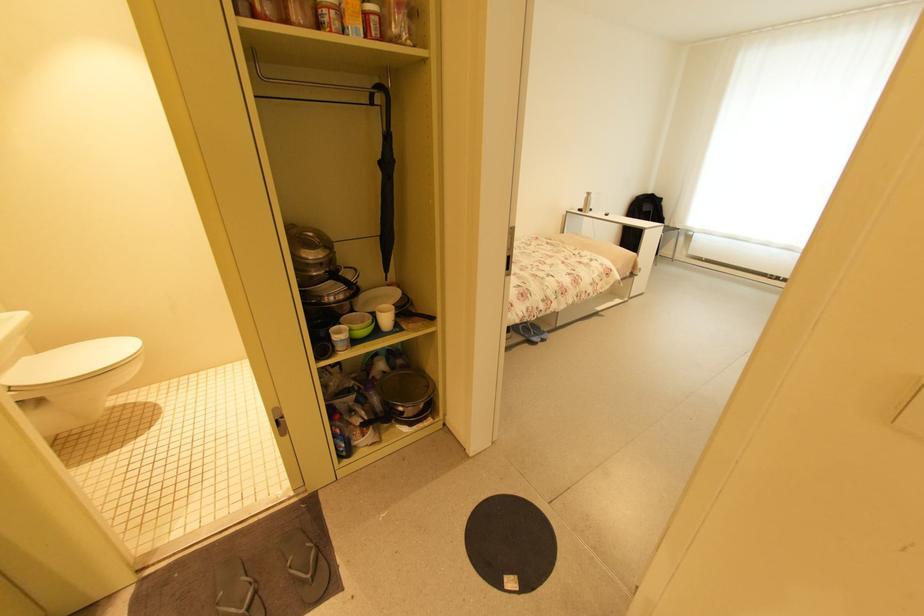
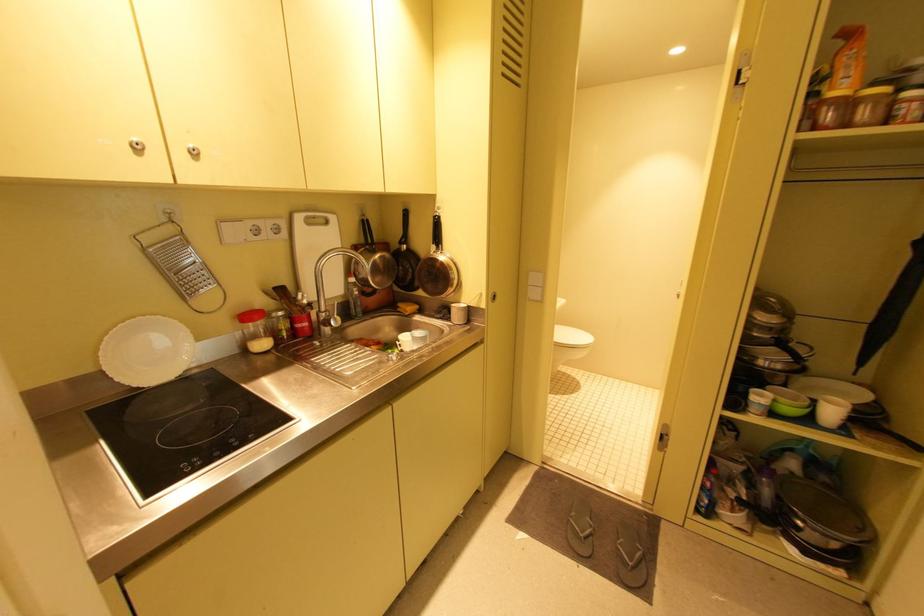
Question: The images are taken continuously from a first-person perspective. In which direction is your viewpoint rotating?

Choices:
 (A) Left
 (B) Right
 (C) Up
 (D) Down

Answer: (A)